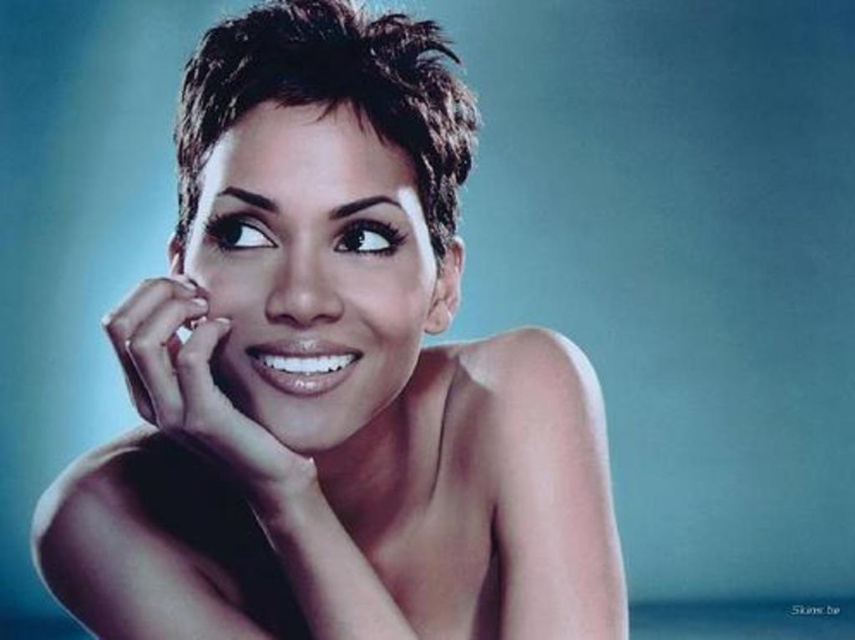
Question: Which object is farther from the camera taking this photo?

Choices:
 (A) dark brown textured hair at center
 (B) smooth skin woman at center

Answer: (A)

Question: Can you confirm if dark brown textured hair at center is positioned above smooth skin hand at center?

Choices:
 (A) yes
 (B) no

Answer: (A)

Question: Estimate the real-world distances between objects in this image. Which object is closer to the dark brown textured hair at center?

Choices:
 (A) smooth skin hand at center
 (B) smooth skin woman at center

Answer: (B)

Question: Can you confirm if smooth skin woman at center is thinner than dark brown textured hair at center?

Choices:
 (A) yes
 (B) no

Answer: (B)

Question: Does smooth skin woman at center have a smaller size compared to smooth skin hand at center?

Choices:
 (A) no
 (B) yes

Answer: (A)

Question: Which point is farther from the camera taking this photo?

Choices:
 (A) (402, 113)
 (B) (125, 301)

Answer: (B)